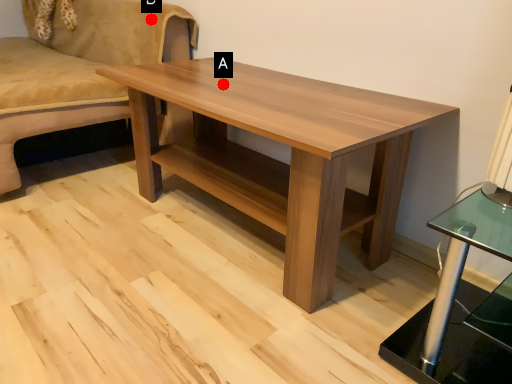
Question: Two points are circled on the image, labeled by A and B beside each circle. Among these points, which one is nearest to the camera?

Choices:
 (A) A is closer
 (B) B is closer

Answer: (A)